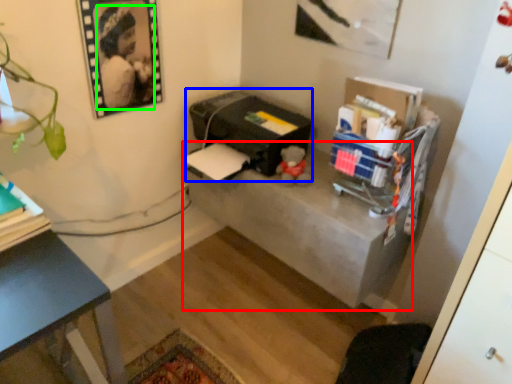
Question: Based on their relative distances, which object is farther from table (highlighted by a red box)? Choose from printer (highlighted by a blue box) and person (highlighted by a green box).

Choices:
 (A) printer
 (B) person

Answer: (B)